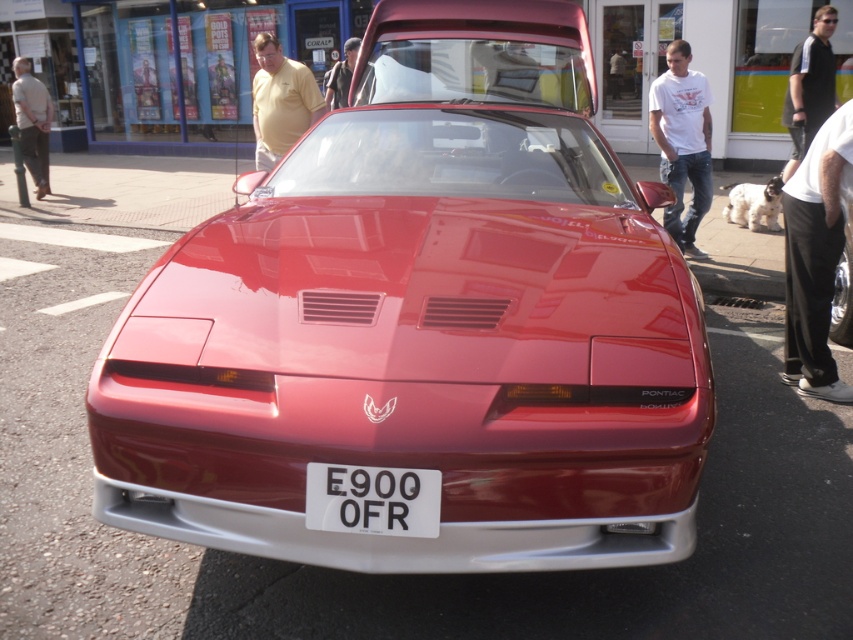
Question: Is white plastic license plate at center further to the viewer compared to yellow cotton shirt at upper left?

Choices:
 (A) yes
 (B) no

Answer: (B)

Question: Where is shiny red car at center located in relation to light beige shirt at left in the image?

Choices:
 (A) above
 (B) below

Answer: (B)

Question: Which point is farther to the camera?

Choices:
 (A) (338, 474)
 (B) (340, 92)
 (C) (456, 49)
 (D) (265, 118)

Answer: (B)

Question: Does white cotton shirt at right have a greater width compared to white plastic license plate at center?

Choices:
 (A) yes
 (B) no

Answer: (A)

Question: Which point appears closest to the camera in this image?

Choices:
 (A) (503, 202)
 (B) (36, 138)

Answer: (A)

Question: Based on their relative distances, which object is farther from the white cotton shirt at right?

Choices:
 (A) white plastic license plate at center
 (B) shiny red car at center
 (C) light beige shirt at left

Answer: (C)